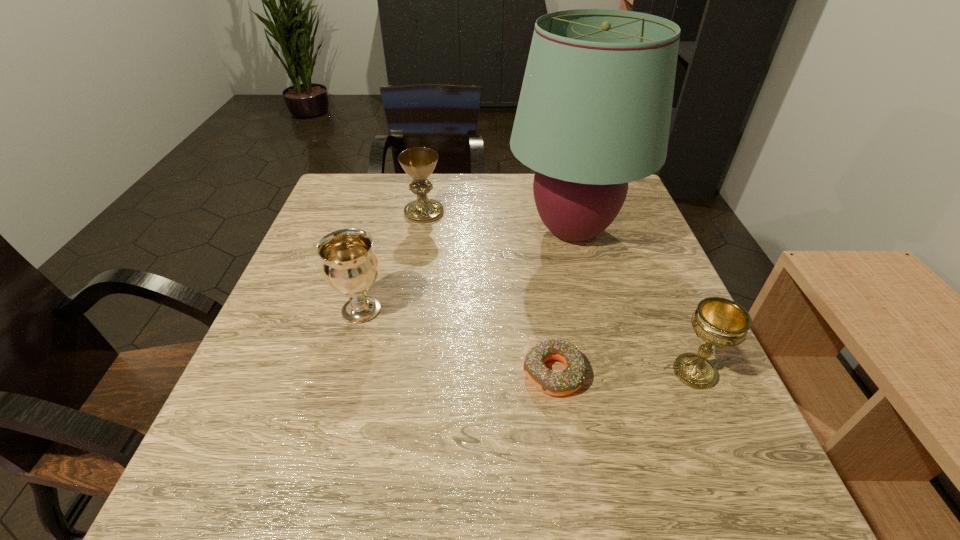
Locate an element on the screen. free space at the near left corner of the desktop is located at coordinates (235, 511).

Find the location of a particular element. This screenshot has width=960, height=540. vacant space that's between the doughnut and the tallest object is located at coordinates tap(563, 302).

Where is `free spot between the rightmost chalice and the tallest object`? Image resolution: width=960 pixels, height=540 pixels. free spot between the rightmost chalice and the tallest object is located at coordinates (634, 301).

Where is `unoccupied position between the nearest chalice and the farthest chalice`? The height and width of the screenshot is (540, 960). unoccupied position between the nearest chalice and the farthest chalice is located at coordinates (560, 292).

Identify the location of free space that is in between the shortest object and the tallest object. The width and height of the screenshot is (960, 540). (563, 302).

The image size is (960, 540). In order to click on empty space between the doughnut and the second farthest chalice in this screenshot , I will do `click(457, 341)`.

This screenshot has width=960, height=540. In order to click on vacant region between the doughnut and the farthest chalice in this screenshot , I will do `click(489, 293)`.

The height and width of the screenshot is (540, 960). I want to click on free space between the doughnut and the rightmost chalice, so click(624, 373).

I want to click on free space between the doughnut and the second nearest chalice, so click(x=457, y=341).

The width and height of the screenshot is (960, 540). What are the coordinates of `free spot between the doughnut and the tallest object` in the screenshot? It's located at (563, 302).